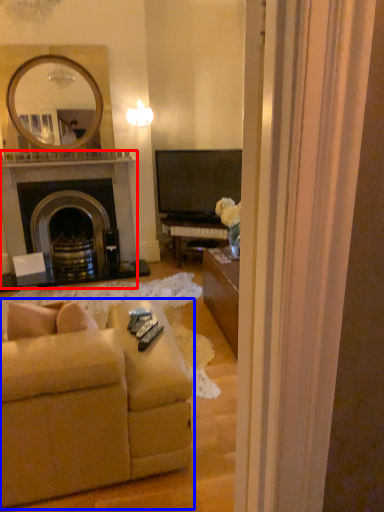
Question: Which point is closer to the camera, fireplace (highlighted by a red box) or studio couch (highlighted by a blue box)?

Choices:
 (A) fireplace
 (B) studio couch

Answer: (B)